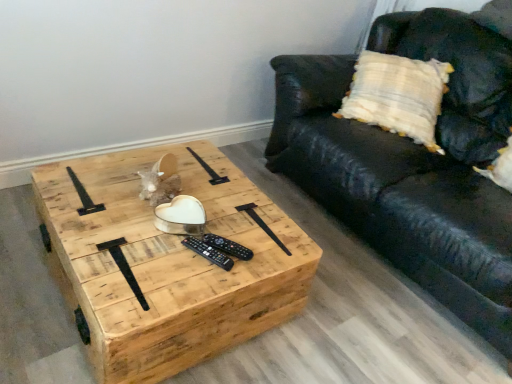
In order to click on vacant area that lies in front of black plastic remote at center, which is the 1th remote from back to front in this screenshot , I will do `click(197, 281)`.